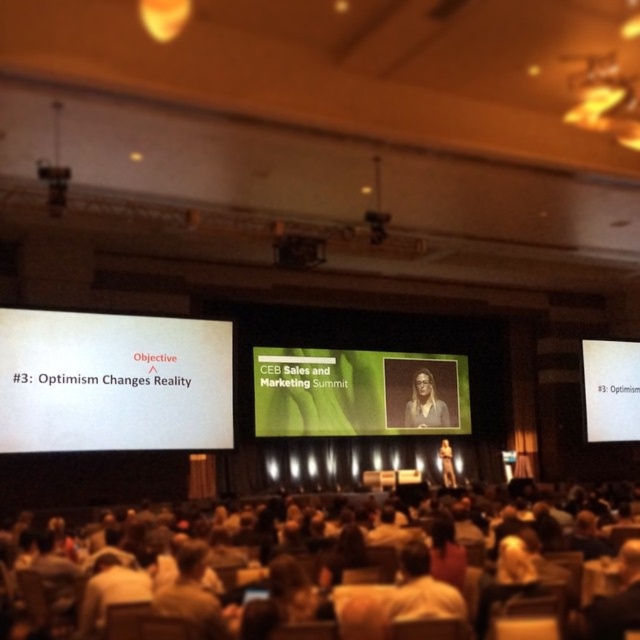
You are an attendee at the CEB Sales and Marketing Summit. You notice the white matte projector screen at left and the matte black suit at center. Which object is positioned higher in the image?

The white matte projector screen at left is located above the matte black suit at center, so it is positioned higher in the image.

Based on the photo, you are attending the CEB Sales and Marketing Summit and want to take a photo of the speaker on stage. The camera you have can focus on subjects within 50 meters. Is the speaker at point [394,385] too far away for your camera to capture clearly?

The distance between point [394,385] and the camera is 60.14 meters, which exceeds the camera maximum focus range of 50 meters. Therefore, the speaker at point [394,385] is too far away for the camera to capture clearly.

You are an attendee at the CEB Sales and Marketing Summit. You notice two items on the stage at center. One is the green matte projection screen at center and the other is the white paper at center. Which one is positioned to the left?

The green matte projection screen at center is to the left of the white paper at center.